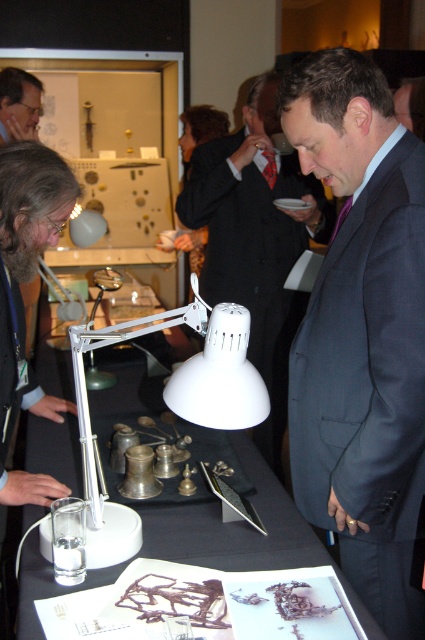
You are setting up for an event and need to place a large banner behind the white plastic table at center. According to the coordinates provided, where should you position the banner relative to the table?

The white plastic table at center is located at point (237,524), so you should position the banner behind it at that coordinate to ensure proper alignment.

You are setting up for an event and need to place a decorative vase between the white plastic table lamp at center and the glass of water next to it. According to the coordinates provided, where should you position the vase?

The white plastic table lamp at center is located at point (175, 390). To place the vase between it and the glass of water next to it, position the vase along the line connecting these two points, ensuring it is equidistant from both or closer to the desired location based on the specific layout.